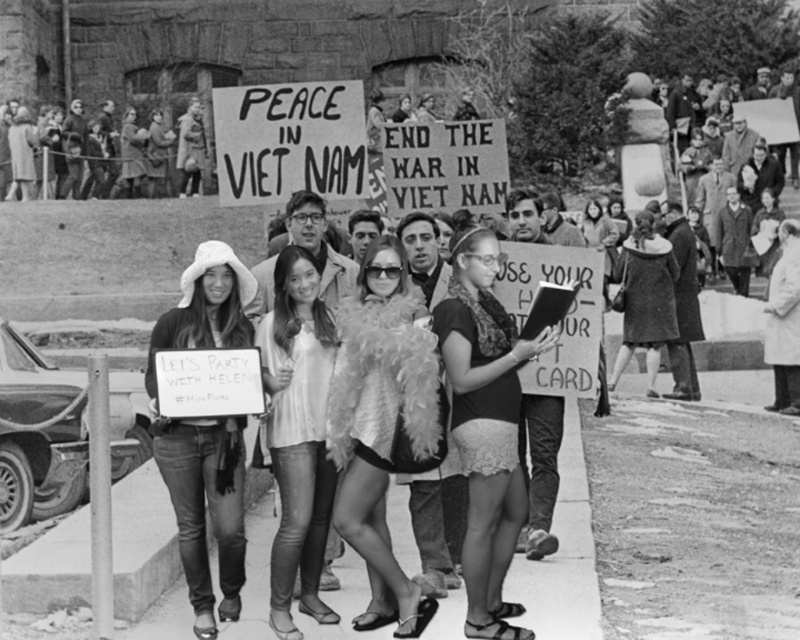
Can you confirm if black lace shorts at center is shorter than white fur coat at center?

No, black lace shorts at center is not shorter than white fur coat at center.

Is point (458, 362) farther from viewer compared to point (774, 401)?

No, it is in front of (774, 401).

Does point (484, 502) come closer to viewer compared to point (796, 296)?

Yes, point (484, 502) is in front of point (796, 296).

The height and width of the screenshot is (640, 800). I want to click on black lace shorts at center, so click(x=486, y=424).

Can you confirm if feathered white capelet at center is taller than denim jeans at center?

No.

Can you confirm if feathered white capelet at center is positioned to the left of denim jeans at center?

Incorrect, feathered white capelet at center is not on the left side of denim jeans at center.

This screenshot has width=800, height=640. In order to click on feathered white capelet at center in this screenshot , I will do `click(381, 422)`.

The width and height of the screenshot is (800, 640). In order to click on feathered white capelet at center in this screenshot , I will do click(x=381, y=422).

Between point (380, 332) and point (662, 307), which one is positioned behind?

Positioned behind is point (662, 307).

Measure the distance between feathered white capelet at center and camera.

feathered white capelet at center and camera are 26.52 meters apart.

Which is in front, point (360, 314) or point (664, 280)?

Positioned in front is point (360, 314).

The width and height of the screenshot is (800, 640). In order to click on feathered white capelet at center in this screenshot , I will do `click(381, 422)`.